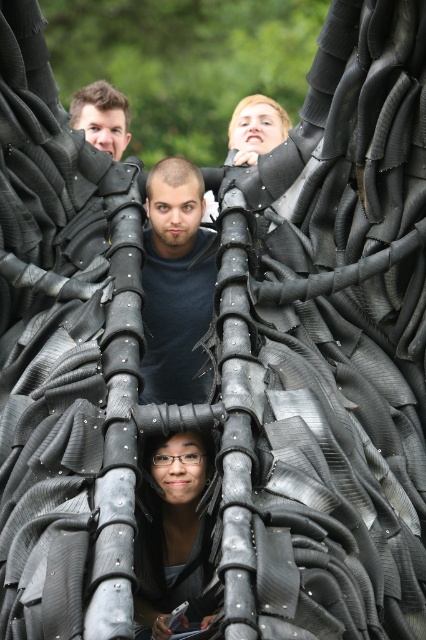
You are a photographer trying to capture a clear shot of the person in the matte black shirt at center and the matte black face at upper left. Which object is closer to the camera?

The matte black face at upper left is closer to the camera than the matte black shirt at center because it is positioned above it.

You are standing at the point where the image was taken. There is a point at coordinates point (201, 456). If you want to move closer to that point, which direction should you move in relation to the structure?

The point at coordinates point (201, 456) is 310.67 feet away from the viewer. To move closer to it, you should move forward towards the structure since the point is located in the direction of the structure from your current position.